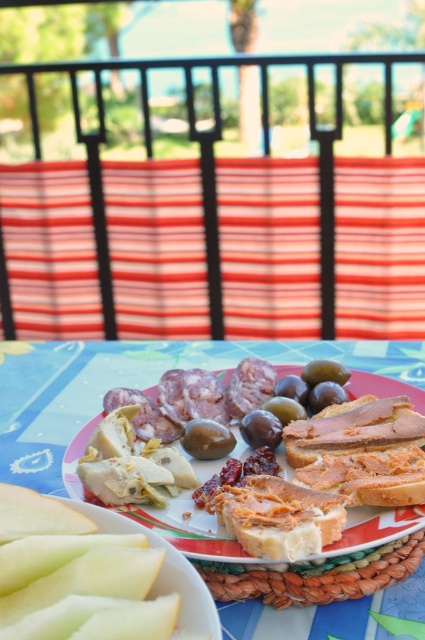
You are planning to serve these olives to guests. Which olive between the green glossy olive at center and the shiny dark green olive at center should you pick if you want the bigger one?

The green glossy olive at center is larger in size than the shiny dark green olive at center, so you should pick the green glossy olive at center.

You are a small toy car that is 2 inches wide. You want to move from the edge of the table to the shiny dark green olive at center without touching the matte white plate at center. Is there enough space for you to navigate around the plate?

The distance between the matte white plate at center and the shiny dark green olive at center is 3.20 inches. Since the toy car is 2 inches wide, there is sufficient space to navigate around the plate as long as it stays within the 3.20 inch gap.